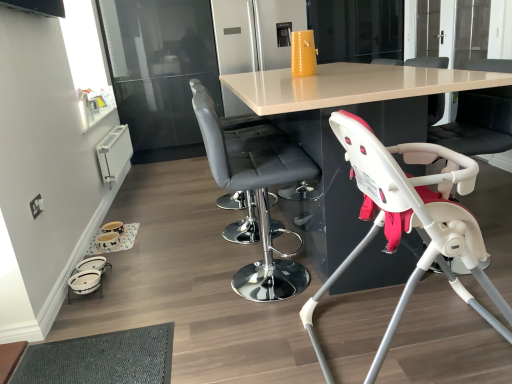
Question: Considering the positions of point (453, 251) and point (261, 170), is point (453, 251) closer or farther from the camera than point (261, 170)?

Choices:
 (A) farther
 (B) closer

Answer: (B)

Question: Is white plastic highchair at lower right, acting as the 1th chair starting from the front, taller or shorter than matte gray bar stool at center, placed as the second chair when sorted from front to back?

Choices:
 (A) tall
 (B) short

Answer: (B)

Question: Based on their relative distances, which object is nearer to the matte gray bar stool at center, placed as the 3th chair when sorted from right to left?

Choices:
 (A) white plastic baby carriage at lower left
 (B) white plastic highchair at lower right, the third chair when ordered from left to right
 (C) matte gray bar stool at center, positioned as the 4th chair in right-to-left order
 (D) black leather chair at right, the fourth chair from the front
 (E) matte white table at center

Answer: (C)

Question: Which is nearer to the white plastic highchair at lower right, acting as the 1th chair starting from the front?

Choices:
 (A) black leather chair at right, the fourth chair from the front
 (B) matte gray bar stool at center, the 2th chair in the back-to-front sequence
 (C) matte gray bar stool at center, placed as the second chair when sorted from front to back
 (D) white plastic baby carriage at lower left
 (E) matte white table at center

Answer: (E)